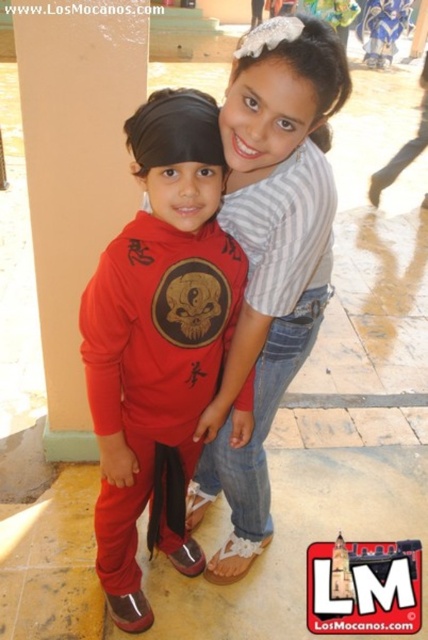
Does matte red ninja suit at center come behind matte beige pillar at left?

No, it is in front of matte beige pillar at left.

Does matte red ninja suit at center have a greater height compared to matte beige pillar at left?

No.

You are a GUI agent. You are given a task and a screenshot of the screen. Output one action in this format:
    pyautogui.click(x=<x>, y=<y>)
    Task: Click on the matte red ninja suit at center
    The height and width of the screenshot is (640, 428).
    Given the screenshot: What is the action you would take?
    pyautogui.click(x=157, y=340)

Consider the image. Is the position of striped cotton shirt at upper center more distant than that of matte beige pillar at left?

No.

Between striped cotton shirt at upper center and matte beige pillar at left, which one is positioned higher?

matte beige pillar at left is higher up.

Is point (252, 308) farther from viewer compared to point (86, 10)?

No, it is in front of (86, 10).

Where is `striped cotton shirt at upper center`? This screenshot has width=428, height=640. striped cotton shirt at upper center is located at coordinates (270, 256).

In the scene shown: Is matte red ninja suit at center in front of striped cotton shirt at upper center?

No.

Can you confirm if matte red ninja suit at center is taller than striped cotton shirt at upper center?

No, matte red ninja suit at center is not taller than striped cotton shirt at upper center.

Find the location of a particular element. matte red ninja suit at center is located at coordinates (157, 340).

This screenshot has width=428, height=640. I want to click on matte red ninja suit at center, so click(x=157, y=340).